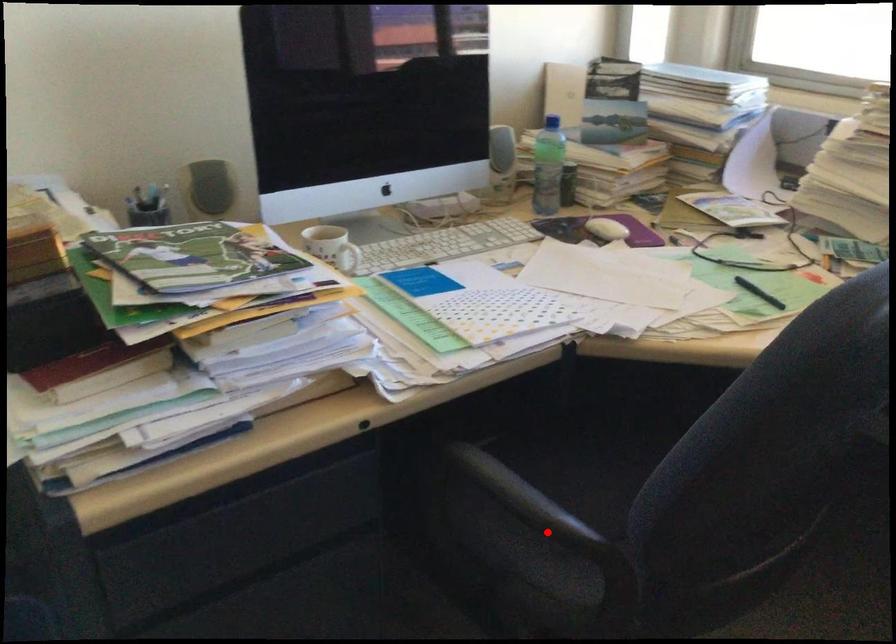
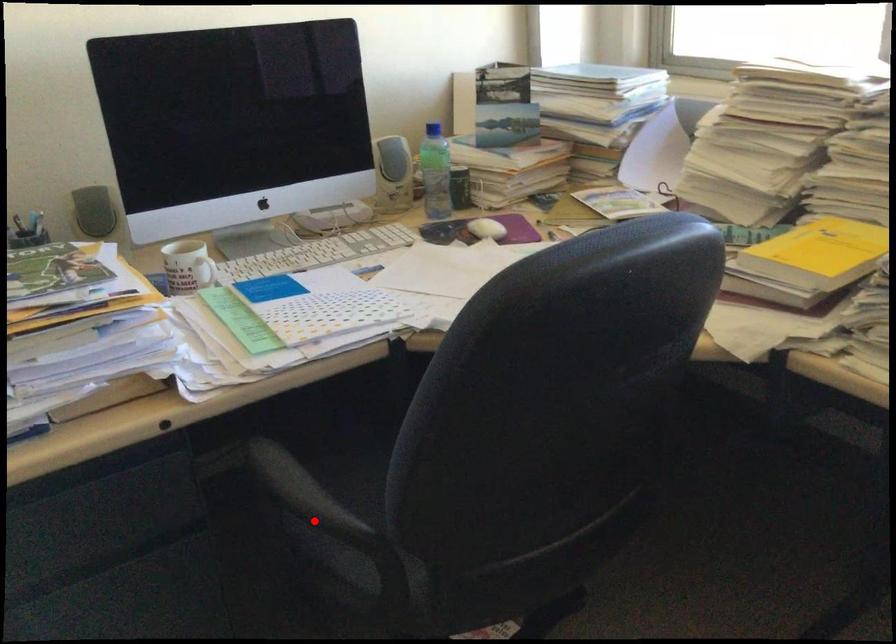
I am providing you with two images of the same scene from different viewpoints. A red point is marked on the first image and another point is marked on the second image. Does the point marked in image1 correspond to the same location as the one in image2?

Yes